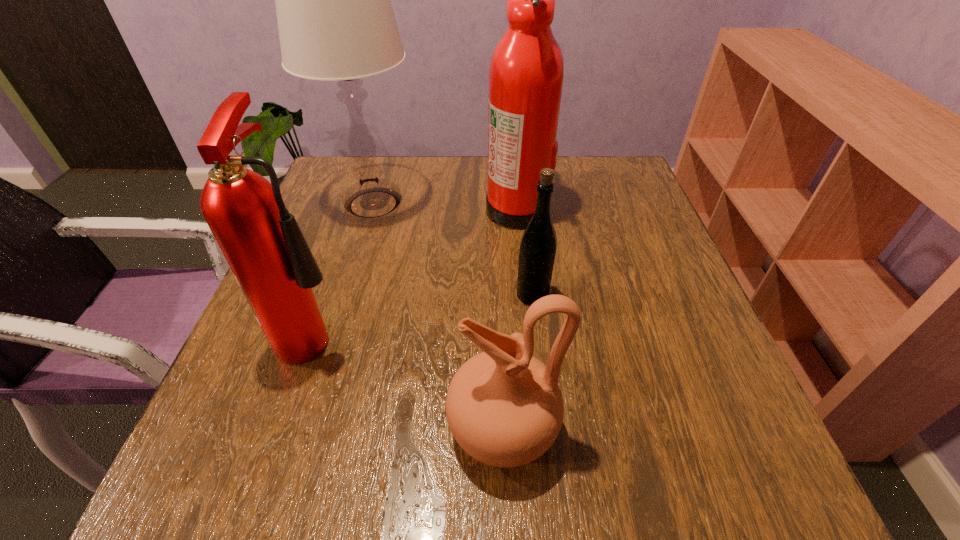
Identify the location of blank region between the table lamp and the pottery. (438, 316).

Locate an element on the screen. vacant area between the right fire extinguisher and the left fire extinguisher is located at coordinates (417, 269).

Where is `free space between the farther fire extinguisher and the pottery`? The image size is (960, 540). free space between the farther fire extinguisher and the pottery is located at coordinates (510, 319).

You are a GUI agent. You are given a task and a screenshot of the screen. Output one action in this format:
    pyautogui.click(x=<x>, y=<y>)
    Task: Click on the free space between the table lamp and the nearest object
    
    Given the screenshot: What is the action you would take?
    pyautogui.click(x=438, y=316)

Find the location of a particular element. This screenshot has height=540, width=960. free space between the shorter fire extinguisher and the pottery is located at coordinates (410, 380).

You are a GUI agent. You are given a task and a screenshot of the screen. Output one action in this format:
    pyautogui.click(x=<x>, y=<y>)
    Task: Click on the free space between the left fire extinguisher and the beer bottle
    The height and width of the screenshot is (540, 960).
    Given the screenshot: What is the action you would take?
    pyautogui.click(x=424, y=313)

The image size is (960, 540). Find the location of `vacant space that's between the table lamp and the farther fire extinguisher`. vacant space that's between the table lamp and the farther fire extinguisher is located at coordinates (445, 206).

The width and height of the screenshot is (960, 540). What are the coordinates of `the fourth closest object to the left fire extinguisher` in the screenshot? It's located at (526, 72).

Where is `object that stands as the fourth closest to the farther fire extinguisher`? The image size is (960, 540). object that stands as the fourth closest to the farther fire extinguisher is located at coordinates (504, 407).

Image resolution: width=960 pixels, height=540 pixels. Find the location of `free location that satisfies the following two spatial constraints: 1. on the front-facing side of the beer bottle; 2. on the left side of the table lamp`. free location that satisfies the following two spatial constraints: 1. on the front-facing side of the beer bottle; 2. on the left side of the table lamp is located at coordinates (347, 295).